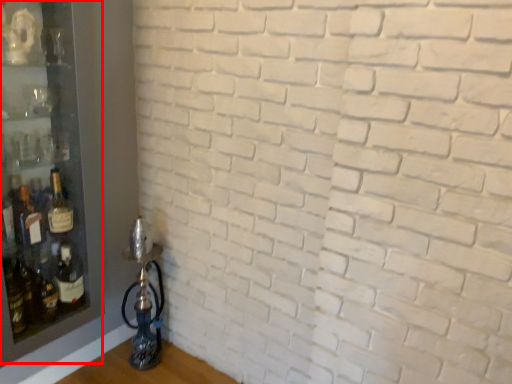
Question: Observing the image, what is the correct spatial positioning of shelf (annotated by the red box) in reference to bottle?

Choices:
 (A) right
 (B) left

Answer: (B)